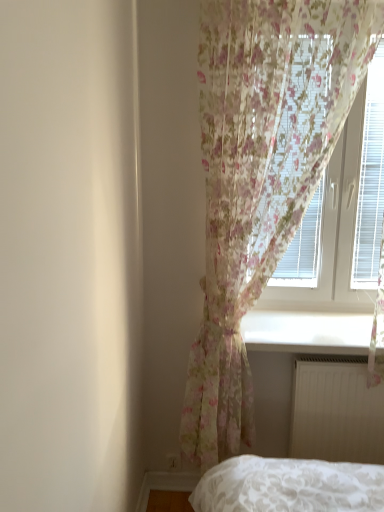
Question: From the image's perspective, is white smooth window sill at lower center positioned above or below white matte radiator at lower right?

Choices:
 (A) above
 (B) below

Answer: (A)

Question: Based on their sizes in the image, would you say white smooth window sill at lower center is bigger or smaller than white matte radiator at lower right?

Choices:
 (A) small
 (B) big

Answer: (B)

Question: Estimate the real-world distances between objects in this image. Which object is closer to the translucent floral curtain at upper right?

Choices:
 (A) white matte radiator at lower right
 (B) white smooth window sill at lower center
 (C) floral sheer curtain at upper right

Answer: (B)

Question: Which of these objects is positioned farthest from the white smooth window sill at lower center?

Choices:
 (A) translucent floral curtain at upper right
 (B) white matte radiator at lower right
 (C) floral sheer curtain at upper right

Answer: (C)